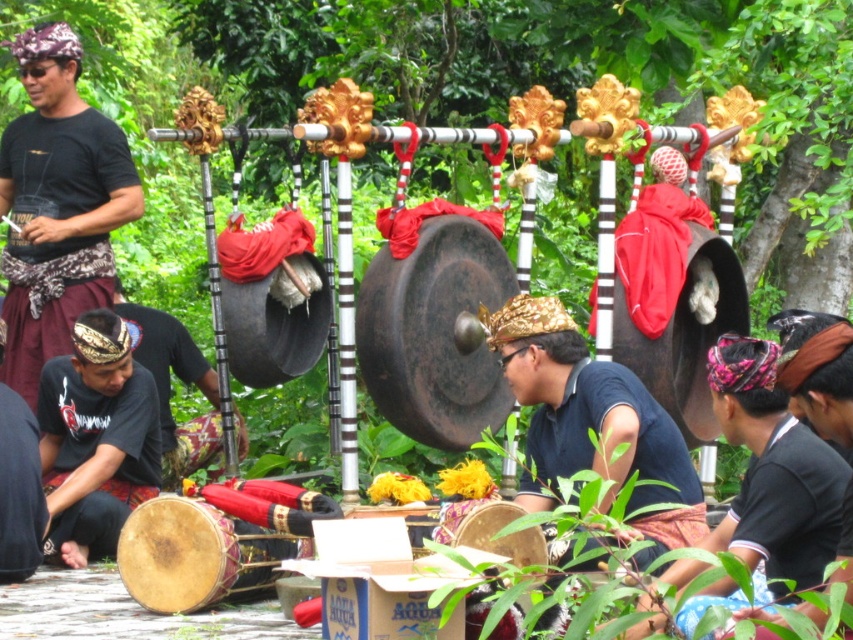
You are a photographer trying to capture the perfect shot of the matte gold crown at center. The camera has a focus point at coordinate point (592, 422). Will this focus point align with the matte gold crown at center?

Yes, the matte gold crown at center is located at point (592, 422) so the focus point will align with it.

You are a photographer positioned at the center of the scene. You need to capture a closeup shot of the matte brown shirt at lower left without including the gong stand. Is the shirt positioned to the left or right of the gong stand?

The matte brown shirt at lower left is positioned to the left of the gong stand, so you can frame the shot to exclude the gong stand by focusing on the left side.

From the picture: You are a photographer wanting to capture the entire scene in one shot. Given that the matte gold crown at center and the matte brown shirt at lower left are both in your frame, which object would require more horizontal space in the photo to fully capture?

The matte gold crown at center requires more horizontal space in the photo because its width surpasses that of the matte brown shirt at lower left.